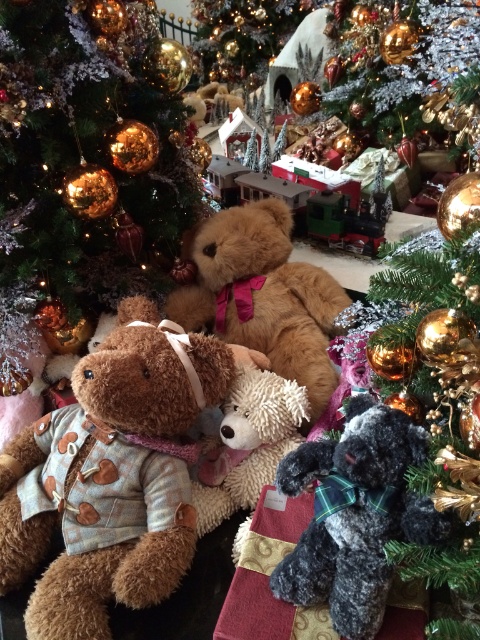
Question: Which of these objects is positioned farthest from the dark gray plush bear at lower right?

Choices:
 (A) shiny gold ornaments at center
 (B) gold metallic ornaments at upper left
 (C) shiny gold ornaments at upper center

Answer: (C)

Question: Can you confirm if gold metallic ornaments at upper left is thinner than shiny gold ornaments at center?

Choices:
 (A) yes
 (B) no

Answer: (B)

Question: Can you confirm if dark gray plush bear at lower right is thinner than soft brown teddy bear at center?

Choices:
 (A) yes
 (B) no

Answer: (A)

Question: Can you confirm if dark gray plush bear at lower right is positioned below soft brown teddy bear at center?

Choices:
 (A) yes
 (B) no

Answer: (A)

Question: Which point is closer to the camera?

Choices:
 (A) shiny gold ornaments at upper center
 (B) dark gray plush bear at lower right
 (C) fluffy beige teddy bear at center

Answer: (B)

Question: Based on their relative distances, which object is farther from the dark gray plush bear at lower right?

Choices:
 (A) fluffy beige teddy bear at center
 (B) soft brown teddy bear at center

Answer: (B)